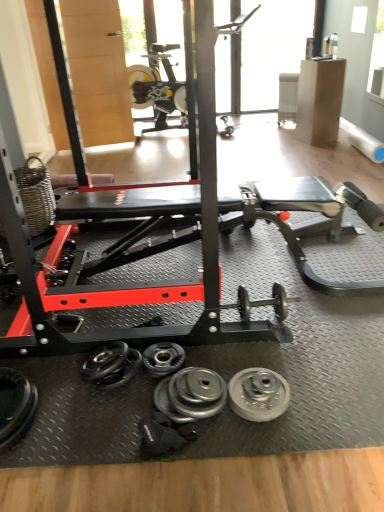
Question: Based on their sizes in the image, would you say transparent glass window at upper center is bigger or smaller than silver metallic weight at center, which is the first wheel in left-to-right order?

Choices:
 (A) big
 (B) small

Answer: (A)

Question: From the image's perspective, relative to silver metallic weight at center, which is the first wheel in left-to-right order, is transparent glass window at upper center above or below?

Choices:
 (A) below
 (B) above

Answer: (B)

Question: Which object is positioned farthest from the silver metallic dumbbell at center, marked as the 2th dumbbell in a right-to-left arrangement?

Choices:
 (A) silver metallic weight at center, arranged as the second wheel when viewed from the left
 (B) silver metallic dumbbell at lower left, arranged as the first dumbbell when viewed from the left
 (C) silver metallic weight at center, which is the first wheel in left-to-right order
 (D) silver metallic dumbbell at center, acting as the third dumbbell starting from the left
 (E) transparent glass window at upper center

Answer: (E)

Question: Which object is the farthest from the silver metallic weight at center, arranged as the second wheel when viewed from the left?

Choices:
 (A) silver metallic dumbbell at center, which is the first dumbbell from right to left
 (B) transparent glass window at upper center
 (C) silver metallic weight at center, which is the first wheel in left-to-right order
 (D) silver metallic dumbbell at lower left, the 3th dumbbell positioned from the right
 (E) silver metallic dumbbell at center, the second dumbbell when ordered from left to right

Answer: (B)